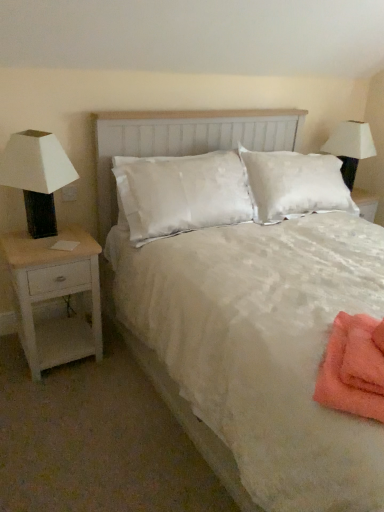
Question: From the image's perspective, is white matte table lamp at left under white fabric lampshade at upper right?

Choices:
 (A) yes
 (B) no

Answer: (A)

Question: Considering the relative positions of white matte table lamp at left and white fabric lampshade at upper right in the image provided, is white matte table lamp at left behind white fabric lampshade at upper right?

Choices:
 (A) yes
 (B) no

Answer: (B)

Question: From the image's perspective, is white matte table lamp at left over white fabric lampshade at upper right?

Choices:
 (A) yes
 (B) no

Answer: (B)

Question: From a real-world perspective, is white matte table lamp at left below white fabric lampshade at upper right?

Choices:
 (A) no
 (B) yes

Answer: (A)

Question: Can you confirm if white matte table lamp at left is thinner than white fabric lampshade at upper right?

Choices:
 (A) no
 (B) yes

Answer: (B)

Question: Considering the relative sizes of white matte table lamp at left and white fabric lampshade at upper right in the image provided, is white matte table lamp at left wider than white fabric lampshade at upper right?

Choices:
 (A) no
 (B) yes

Answer: (A)

Question: From a real-world perspective, is white wood nightstand at left positioned under white fabric lampshade at upper right based on gravity?

Choices:
 (A) yes
 (B) no

Answer: (A)

Question: Does white wood nightstand at left have a smaller size compared to white fabric lampshade at upper right?

Choices:
 (A) no
 (B) yes

Answer: (A)

Question: From the image's perspective, is white wood nightstand at left on white fabric lampshade at upper right?

Choices:
 (A) no
 (B) yes

Answer: (A)

Question: Is white wood nightstand at left wider than white fabric lampshade at upper right?

Choices:
 (A) yes
 (B) no

Answer: (A)

Question: Is there a large distance between white wood nightstand at left and white fabric lampshade at upper right?

Choices:
 (A) yes
 (B) no

Answer: (A)

Question: Is white wood nightstand at left positioned behind white fabric lampshade at upper right?

Choices:
 (A) yes
 (B) no

Answer: (B)

Question: Does white matte table lamp at left have a greater height compared to orange towel at lower right?

Choices:
 (A) no
 (B) yes

Answer: (B)